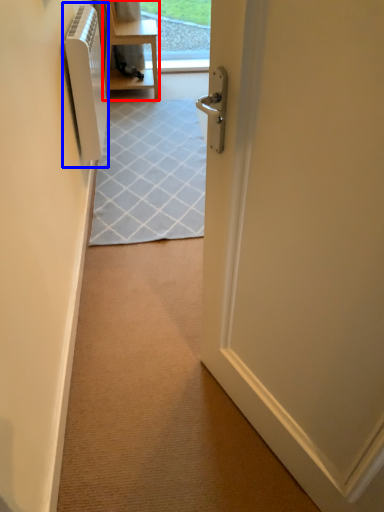
Question: Which object is closer to the camera taking this photo, furniture (highlighted by a red box) or air conditioner (highlighted by a blue box)?

Choices:
 (A) furniture
 (B) air conditioner

Answer: (B)